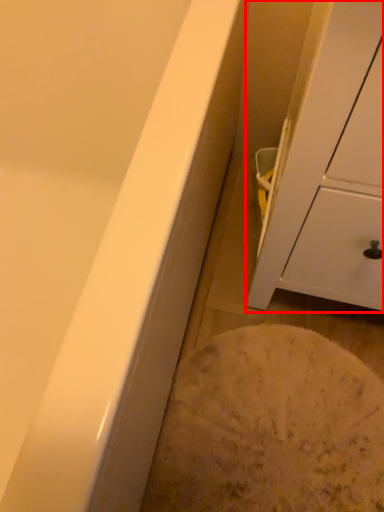
Question: Observing the image, what is the correct spatial positioning of cabinetry (annotated by the red box) in reference to flour?

Choices:
 (A) left
 (B) right

Answer: (B)